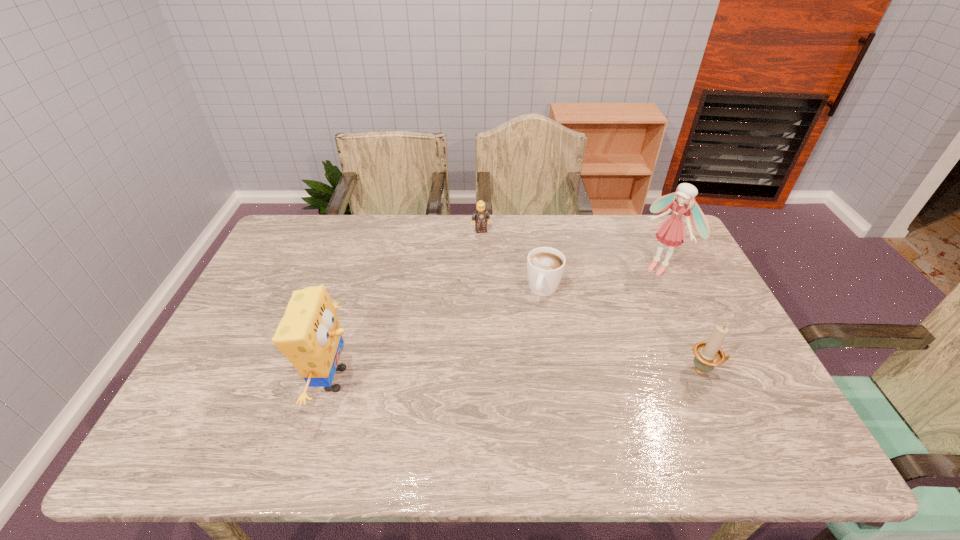
Locate an element on the screen. The height and width of the screenshot is (540, 960). vacant space on the desktop that is between the second tallest object and the candle_holder and is positioned on the front-facing side of the doll is located at coordinates (512, 375).

What are the coordinates of `free spot on the desktop that is between the sponge and the candle_holder and is positioned with the handle on the side of the cappuccino` in the screenshot? It's located at (514, 375).

The height and width of the screenshot is (540, 960). Identify the location of free space on the desktop that is between the fourth shortest object and the candle_holder and is positioned in front of the farthest object. (x=525, y=374).